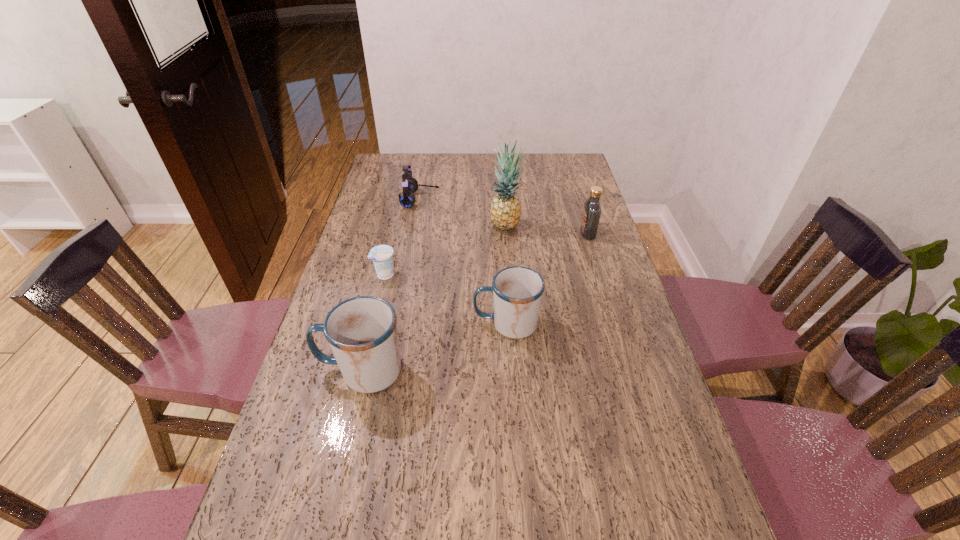
Locate an element on the screen. yogurt that is at the left edge is located at coordinates (382, 255).

Where is `object located in the right edge section of the desktop`? object located in the right edge section of the desktop is located at coordinates (592, 210).

You are a GUI agent. You are given a task and a screenshot of the screen. Output one action in this format:
    pyautogui.click(x=<x>, y=<y>)
    Task: Click on the vacant space at the far edge of the desktop
    The width and height of the screenshot is (960, 540).
    Given the screenshot: What is the action you would take?
    pyautogui.click(x=438, y=171)

In the image, there is a desktop. Where is `vacant space at the left edge`? The width and height of the screenshot is (960, 540). vacant space at the left edge is located at coordinates (308, 368).

What are the coordinates of `vacant space at the right edge of the desktop` in the screenshot? It's located at (644, 465).

Locate an element on the screen. The width and height of the screenshot is (960, 540). vacant area at the near right corner of the desktop is located at coordinates (645, 531).

The image size is (960, 540). What are the coordinates of `free space that is in between the pineapple and the shortest object` in the screenshot? It's located at pyautogui.click(x=445, y=250).

I want to click on free point between the headset and the fourth farthest object, so click(402, 237).

Locate an element on the screen. vacant point located between the farther mug and the taller mug is located at coordinates (434, 347).

The image size is (960, 540). In order to click on unoccupied area between the vodka and the fourth farthest object in this screenshot , I will do `click(487, 254)`.